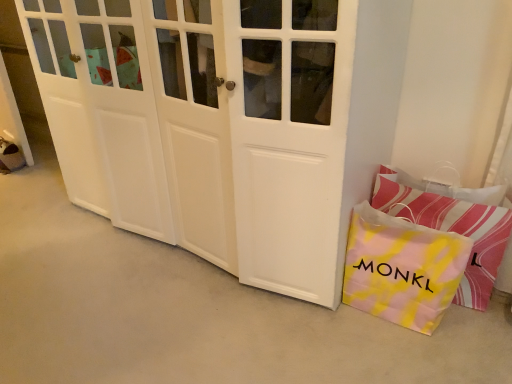
Locate an element on the screen. This screenshot has height=384, width=512. free space in front of yellow tie-dye paper bag at lower right is located at coordinates (411, 357).